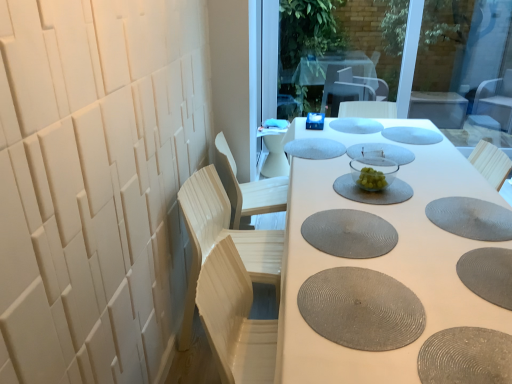
Where is `free space between gray textured placemat at lower right, the eighth manhole cover in the back-to-front sequence, and gray textured placemat at center, which is the 2th manhole cover in front-to-back order`? This screenshot has height=384, width=512. free space between gray textured placemat at lower right, the eighth manhole cover in the back-to-front sequence, and gray textured placemat at center, which is the 2th manhole cover in front-to-back order is located at coordinates (428, 289).